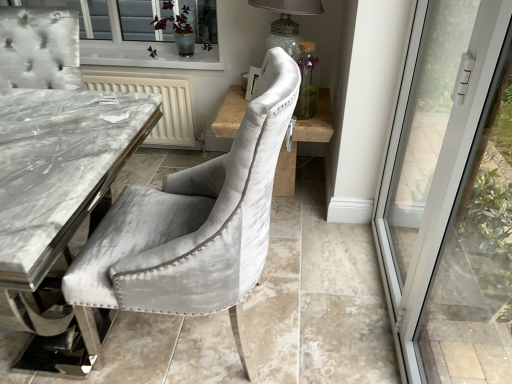
Where is `free space between transparent glass door at right and light brown wood side table at center`? The width and height of the screenshot is (512, 384). free space between transparent glass door at right and light brown wood side table at center is located at coordinates point(320,279).